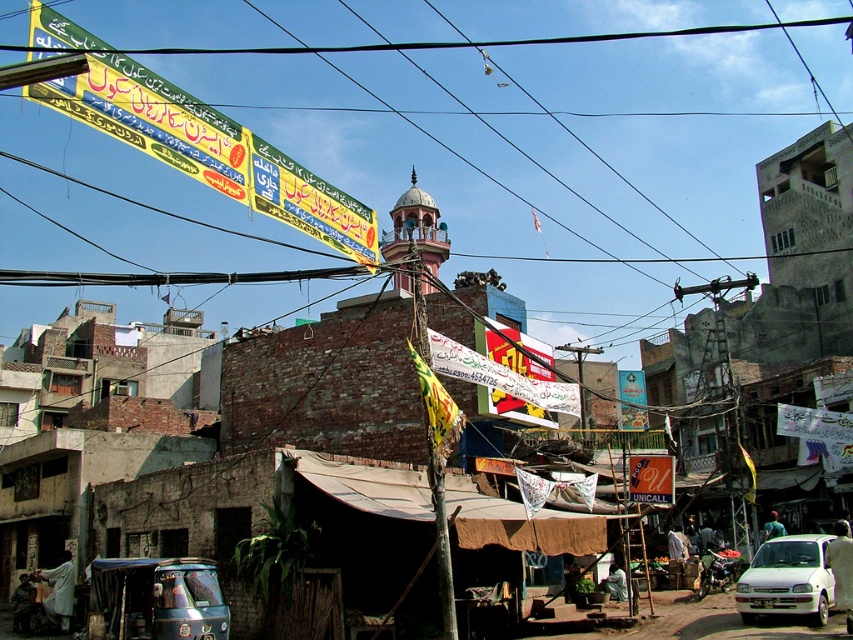
You are a delivery driver navigating through the bustling urban street scene. You need to turn left at the pink marble minaret at center. Which direction should you drive relative to the white matte car at lower right to make the turn?

To turn left at the pink marble minaret at center, you should drive to the left of the white matte car at lower right since it is positioned on the right side of the minaret.